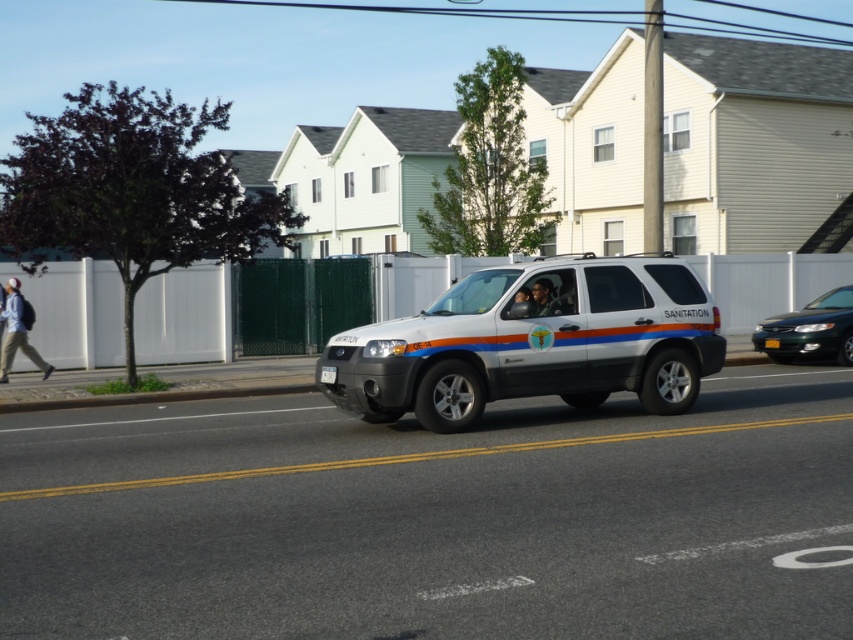
You are standing at the camera position looking at the white Ford Escape SUV. There are two points marked on the vehicle. One is at coordinate point (480, 403) and the other is at point (828, 298). Which of these two points is physically closer to you?

Point (480, 403) is closer to the camera than point (828, 298).

You are a pedestrian standing on the sidewalk and see the white matte suv at center and the metallic green sedan at center driving on the road. Which vehicle is closer to you?

The white matte suv at center is closer to you because it is located below the metallic green sedan at center, meaning it is positioned lower in the image and thus nearer to the observer.